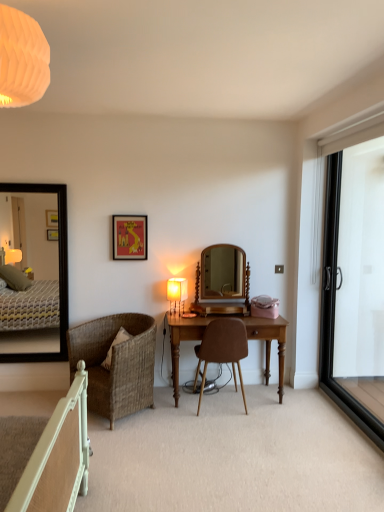
In order to click on vacant area located to the right-hand side of wooden desk at center in this screenshot , I will do `click(311, 406)`.